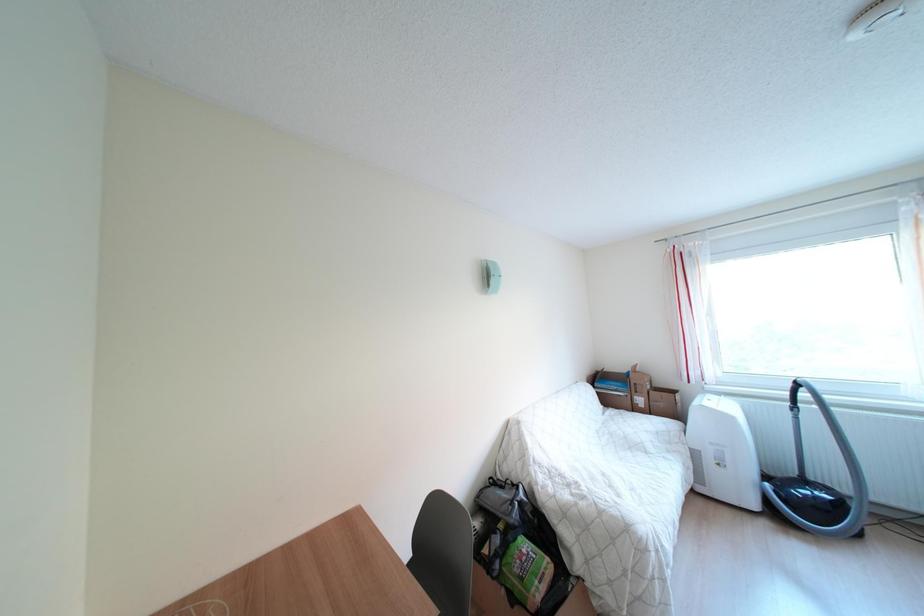
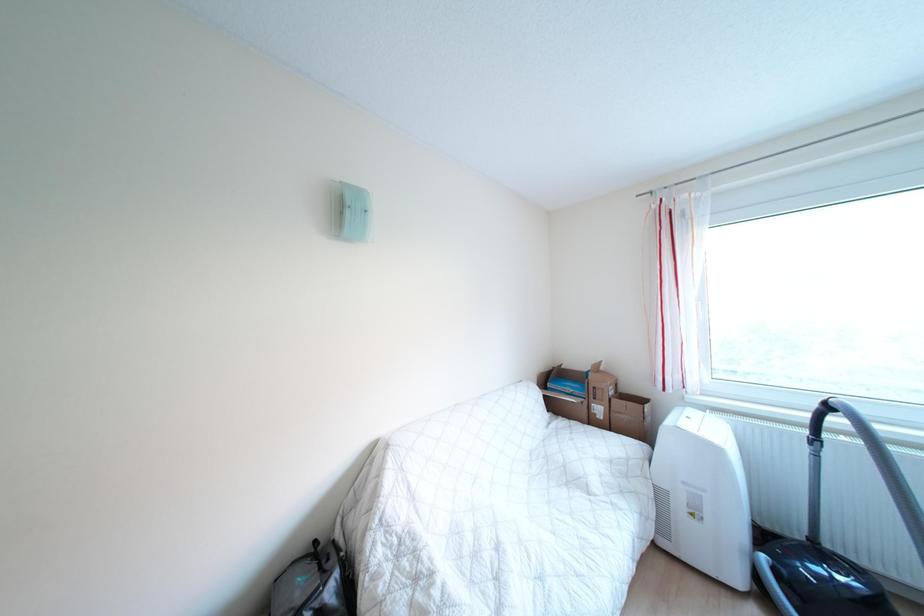
In a continuous first-person perspective shot, in which direction is the camera moving?

The cameraman moved toward right, forward.